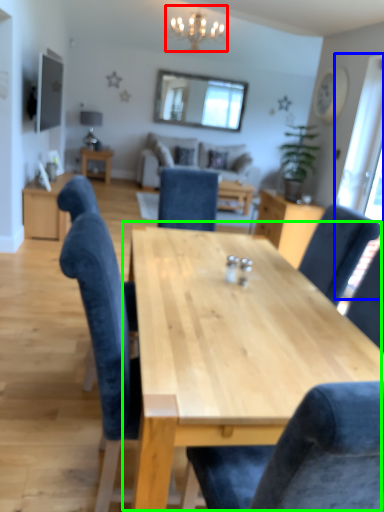
Question: Based on their relative distances, which object is nearer to light fixture (highlighted by a red box)? Choose from window screen (highlighted by a blue box) and table (highlighted by a green box).

Choices:
 (A) window screen
 (B) table

Answer: (A)